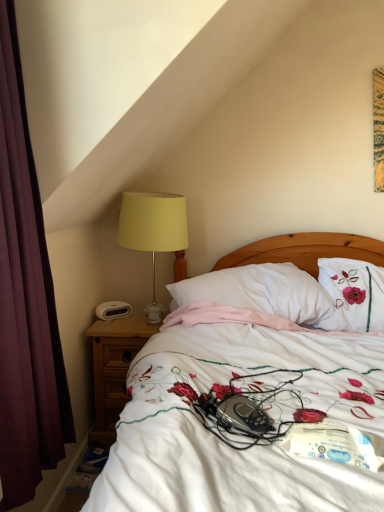
What do you see at coordinates (224, 444) in the screenshot? I see `white floral bedspread at center` at bounding box center [224, 444].

The height and width of the screenshot is (512, 384). Find the location of `white floral bedspread at center`. white floral bedspread at center is located at coordinates (224, 444).

The image size is (384, 512). Describe the element at coordinates (25, 301) in the screenshot. I see `maroon fabric curtain at left` at that location.

Measure the distance between maroon fabric curtain at left and camera.

The depth of maroon fabric curtain at left is 1.07 meters.

In order to click on white plastic alarm clock at left in this screenshot , I will do `click(113, 310)`.

Where is `yellow fabric lampshade at left`? This screenshot has height=512, width=384. yellow fabric lampshade at left is located at coordinates (153, 230).

I want to click on white floral bedspread at center, so click(x=224, y=444).

Is brown wooden nightstand at lower left positioned with its back to white plastic alarm clock at left?

No, brown wooden nightstand at lower left is not facing away from white plastic alarm clock at left.

Which is in front, brown wooden nightstand at lower left or white plastic alarm clock at left?

brown wooden nightstand at lower left is closer to the camera.

How different are the orientations of brown wooden nightstand at lower left and white plastic alarm clock at left in degrees?

brown wooden nightstand at lower left and white plastic alarm clock at left are facing 41.3 degrees away from each other.

From a real-world perspective, is white floral bedspread at center under white plastic alarm clock at left?

Yes.

Does white floral bedspread at center have a lesser height compared to white plastic alarm clock at left?

In fact, white floral bedspread at center may be taller than white plastic alarm clock at left.

Visually, is white floral bedspread at center positioned to the left or to the right of white plastic alarm clock at left?

In the image, white floral bedspread at center appears on the right side of white plastic alarm clock at left.

Considering the sizes of objects white floral bedspread at center and white plastic alarm clock at left in the image provided, who is thinner, white floral bedspread at center or white plastic alarm clock at left?

white plastic alarm clock at left.

From a real-world perspective, which is physically above, brown wooden nightstand at lower left or yellow fabric lampshade at left?

yellow fabric lampshade at left is physically above.

Looking at the image, does brown wooden nightstand at lower left seem bigger or smaller compared to yellow fabric lampshade at left?

Clearly, brown wooden nightstand at lower left is larger in size than yellow fabric lampshade at left.

How different are the orientations of brown wooden nightstand at lower left and yellow fabric lampshade at left in degrees?

They differ by 2.11 degrees in their facing directions.

Identify the location of nightstand located behind the yellow fabric lampshade at left. The width and height of the screenshot is (384, 512). (114, 369).

Would you say white soft pillow at center is to the left or to the right of white floral bedspread at center in the picture?

Based on their positions, white soft pillow at center is located to the left of white floral bedspread at center.

From a real-world perspective, is white soft pillow at center positioned above or below white floral bedspread at center?

white soft pillow at center is situated higher than white floral bedspread at center in the real world.

Is white soft pillow at center turned away from white floral bedspread at center?

Correct, white soft pillow at center is looking away from white floral bedspread at center.

Which point is more forward, (x=312, y=315) or (x=8, y=126)?

The point (x=8, y=126) is closer.

From a real-world perspective, who is located lower, white soft pillow at center or maroon fabric curtain at left?

white soft pillow at center is physically lower.

How many degrees apart are the facing directions of white soft pillow at center and maroon fabric curtain at left?

The facing directions of white soft pillow at center and maroon fabric curtain at left are 78.4 degrees apart.

Is white soft pillow at center closer to the viewer compared to maroon fabric curtain at left?

No, it is not.

Consider the image. Between white plastic alarm clock at left and yellow fabric lampshade at left, which one has less height?

white plastic alarm clock at left.

Is white plastic alarm clock at left further to the viewer compared to yellow fabric lampshade at left?

That is True.

Where is `alarm clock on the left of yellow fabric lampshade at left`? The height and width of the screenshot is (512, 384). alarm clock on the left of yellow fabric lampshade at left is located at coordinates (113, 310).

Is white floral bedspread at center aimed at white soft pillow at center?

No, white floral bedspread at center does not turn towards white soft pillow at center.

Is white floral bedspread at center thinner than white soft pillow at center?

Incorrect, the width of white floral bedspread at center is not less than that of white soft pillow at center.

Based on the photo, does white floral bedspread at center have a smaller size compared to white soft pillow at center?

Actually, white floral bedspread at center might be larger than white soft pillow at center.

The width and height of the screenshot is (384, 512). In the image, there is a white soft pillow at center. What are the coordinates of `bed below it (from the image's perspective)` in the screenshot? It's located at (224, 444).

Where is `alarm clock behind the brown wooden nightstand at lower left`? This screenshot has height=512, width=384. alarm clock behind the brown wooden nightstand at lower left is located at coordinates (113, 310).

You are a GUI agent. You are given a task and a screenshot of the screen. Output one action in this format:
    pyautogui.click(x=<x>, y=<y>)
    Task: Click on the bed in front of the white plastic alarm clock at left
    The image size is (384, 512).
    Given the screenshot: What is the action you would take?
    pyautogui.click(x=224, y=444)

Based on their spatial positions, is white soft pillow at center or brown wooden nightstand at lower left further from white plastic alarm clock at left?

Based on the image, white soft pillow at center appears to be further to white plastic alarm clock at left.

Based on their spatial positions, is maroon fabric curtain at left or white soft pillow at center closer to white floral bedspread at center?

Based on the image, white soft pillow at center appears to be nearer to white floral bedspread at center.

When comparing their distances from brown wooden nightstand at lower left, does yellow fabric lampshade at left or maroon fabric curtain at left seem further?

maroon fabric curtain at left is positioned further to the anchor brown wooden nightstand at lower left.

Looking at the image, which one is located closer to white soft pillow at center, white plastic alarm clock at left or white floral bedspread at center?

The object closer to white soft pillow at center is white floral bedspread at center.

When comparing their distances from yellow fabric lampshade at left, does white floral bedspread at center or white soft pillow at center seem further?

The object further to yellow fabric lampshade at left is white floral bedspread at center.

Looking at the image, which one is located further to maroon fabric curtain at left, white floral bedspread at center or white plastic alarm clock at left?

Among the two, white plastic alarm clock at left is located further to maroon fabric curtain at left.

When comparing their distances from yellow fabric lampshade at left, does brown wooden nightstand at lower left or maroon fabric curtain at left seem closer?

Based on the image, brown wooden nightstand at lower left appears to be nearer to yellow fabric lampshade at left.

Which object lies nearer to the anchor point maroon fabric curtain at left, yellow fabric lampshade at left or brown wooden nightstand at lower left?

brown wooden nightstand at lower left is positioned closer to the anchor maroon fabric curtain at left.

Find the location of `pillow between yellow fabric lampshade at left and brown wooden nightstand at lower left in the up-down direction`. pillow between yellow fabric lampshade at left and brown wooden nightstand at lower left in the up-down direction is located at coordinates (260, 291).

At what (x,y) coordinates should I click in order to perform the action: click on lamp between white floral bedspread at center and brown wooden nightstand at lower left from front to back. Please return your answer as a coordinate pair (x, y). Looking at the image, I should click on (153, 230).

Image resolution: width=384 pixels, height=512 pixels. Identify the location of lamp between maroon fabric curtain at left and white plastic alarm clock at left in the front-back direction. (153, 230).

Where is `pillow positioned between white floral bedspread at center and yellow fabric lampshade at left from near to far`? The image size is (384, 512). pillow positioned between white floral bedspread at center and yellow fabric lampshade at left from near to far is located at coordinates (260, 291).